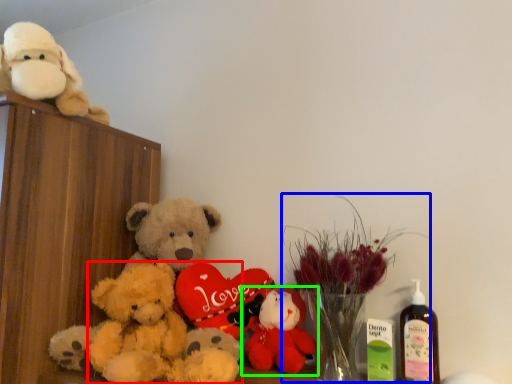
Question: Estimate the real-world distances between objects in this image. Which object is farther from teddy bear (highlighted by a red box), floral arrangement (highlighted by a blue box) or toy (highlighted by a green box)?

Choices:
 (A) floral arrangement
 (B) toy

Answer: (A)